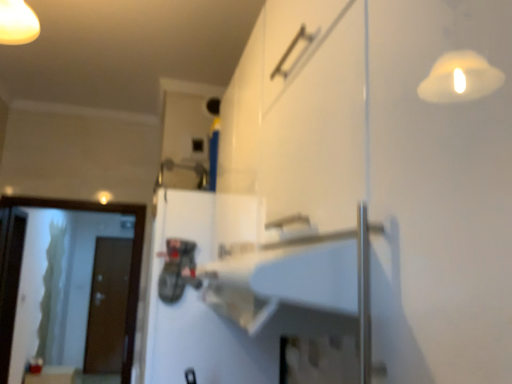
Question: Is white glossy screen door at left, the first screen door in the front-to-back sequence, in front of or behind white matte door at center, marked as the 1th door in a front-to-back arrangement, in the image?

Choices:
 (A) front
 (B) behind

Answer: (B)

Question: From a real-world perspective, relative to white matte door at center, which ranks as the first door in top-to-bottom order, is white glossy screen door at left, the 2th screen door in the left-to-right sequence, vertically above or below?

Choices:
 (A) below
 (B) above

Answer: (A)

Question: Based on their relative distances, which object is farther from the brown matte door at left, which ranks as the first door in left-to-right order?

Choices:
 (A) white glossy screen door at left, the first screen door in the front-to-back sequence
 (B) transparent glass screen door at left, the second screen door in the right-to-left sequence
 (C) white matte door at center, which ranks as the second door in bottom-to-top order

Answer: (C)

Question: Which object is positioned closest to the white glossy screen door at left, placed as the second screen door when sorted from back to front?

Choices:
 (A) white matte door at center, which ranks as the first door in top-to-bottom order
 (B) transparent glass screen door at left, the 1th screen door positioned from the back
 (C) brown matte door at left, which ranks as the first door in back-to-front order

Answer: (C)